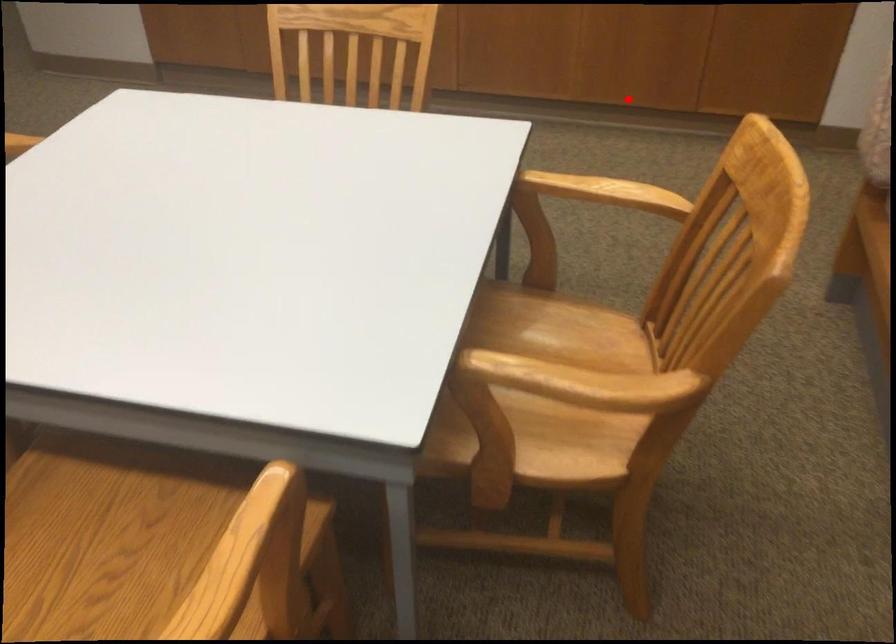
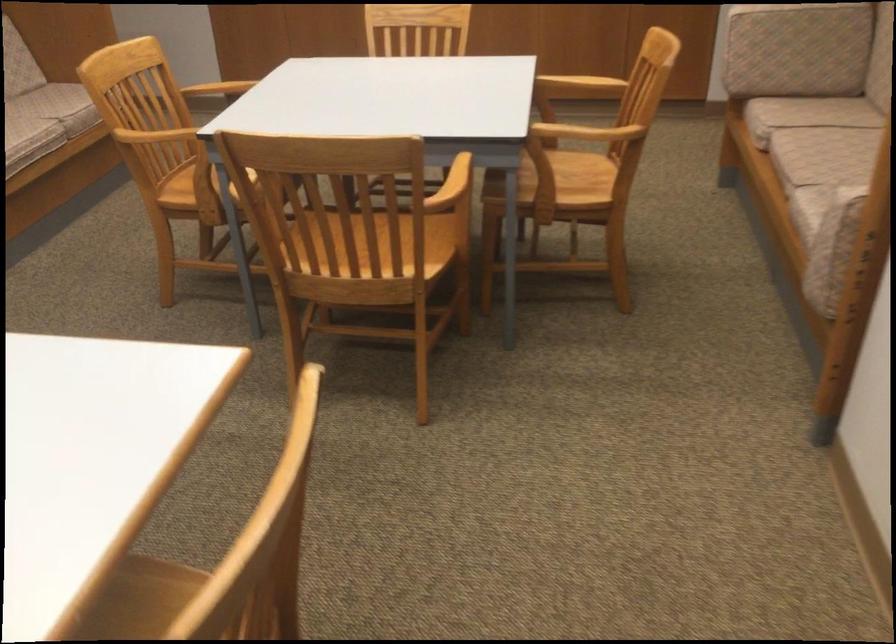
Find the pixel in the second image that matches the highlighted location in the first image.

(580, 84)